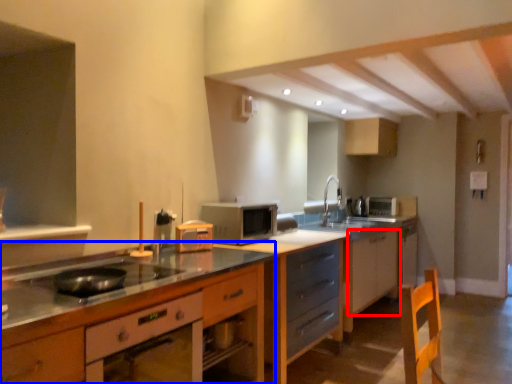
Question: Among these objects, which one is farthest to the camera, cabinetry (highlighted by a red box) or cabinetry (highlighted by a blue box)?

Choices:
 (A) cabinetry
 (B) cabinetry

Answer: (A)